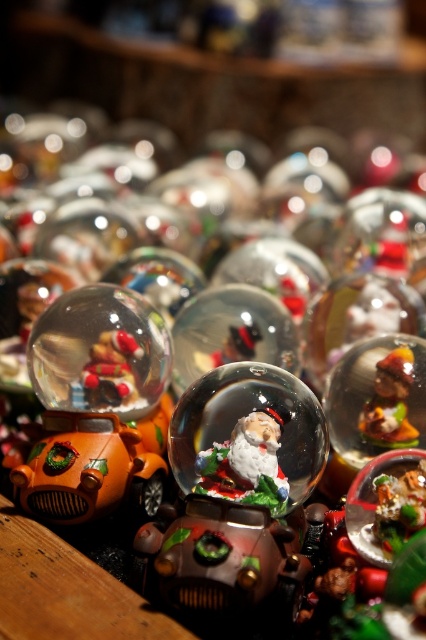
Which is below, translucent glass snow globe at center or clear glass snow globe at center?

translucent glass snow globe at center

Is translucent glass snow globe at center taller than clear glass snow globe at center?

No, translucent glass snow globe at center is not taller than clear glass snow globe at center.

Where is `translucent glass snow globe at center`? The image size is (426, 640). translucent glass snow globe at center is located at coordinates point(249,436).

Between translucent glass snow globe at center and shiny silver santa at center, which one has less height?

shiny silver santa at center is shorter.

Which is in front, point (287, 481) or point (236, 435)?

Positioned in front is point (287, 481).

Where is `translucent glass snow globe at center`? The width and height of the screenshot is (426, 640). translucent glass snow globe at center is located at coordinates (249, 436).

Between point (86, 292) and point (261, 416), which one is positioned behind?

The point (86, 292) is behind.

Is clear glass snow globe at center below shiny silver santa at center?

Incorrect, clear glass snow globe at center is not positioned below shiny silver santa at center.

Who is more forward, (147, 385) or (267, 461)?

Point (267, 461) is more forward.

You are a GUI agent. You are given a task and a screenshot of the screen. Output one action in this format:
    pyautogui.click(x=<x>, y=<y>)
    Task: Click on the clear glass snow globe at center
    
    Given the screenshot: What is the action you would take?
    pyautogui.click(x=100, y=353)